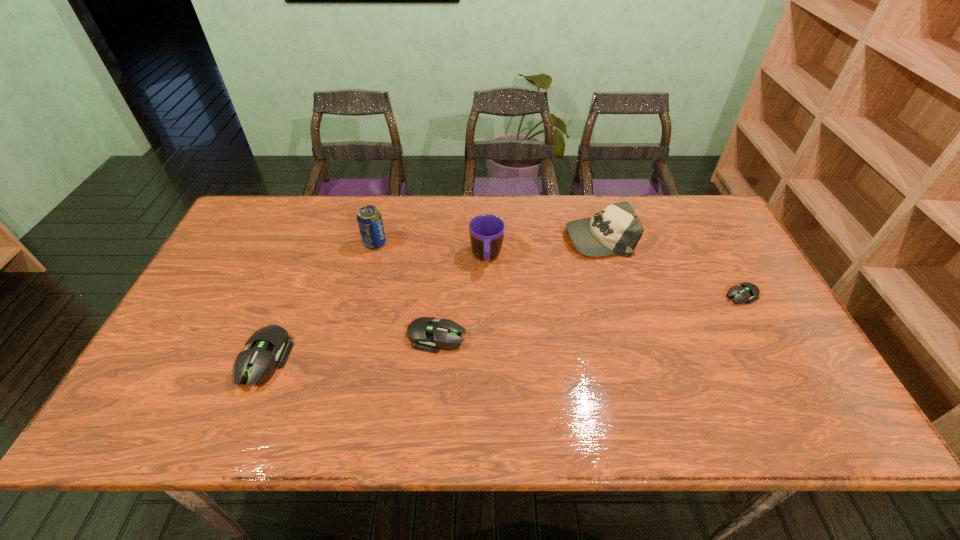
This screenshot has height=540, width=960. Identify the location of location for an additional mouse_(computer_equipment) to make spacing equal. (595, 314).